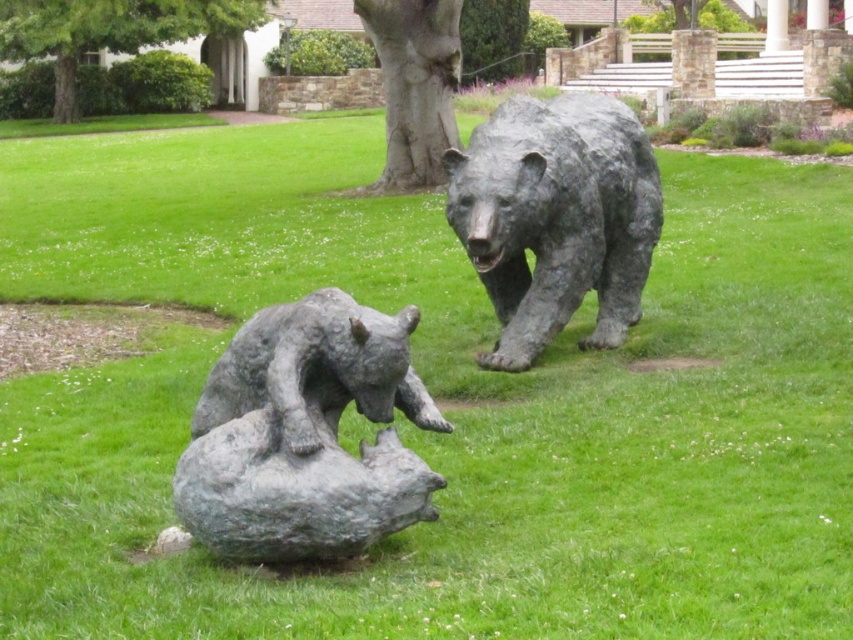
Between bronze bear at center and green leafy tree at upper center, which one has less height?

Standing shorter between the two is green leafy tree at upper center.

Is bronze bear at center wider than green leafy tree at upper center?

Yes.

Is point (250, 538) positioned behind point (229, 10)?

No.

Find the location of a particular element. bronze bear at center is located at coordinates (306, 435).

Does rough gray bear at center have a lesser height compared to green leafy tree at upper center?

In fact, rough gray bear at center may be taller than green leafy tree at upper center.

Between rough gray bear at center and green leafy tree at upper center, which one appears on the left side from the viewer's perspective?

green leafy tree at upper center is more to the left.

Describe the element at coordinates (556, 218) in the screenshot. The width and height of the screenshot is (853, 640). I see `rough gray bear at center` at that location.

Locate an element on the screen. rough gray bear at center is located at coordinates (556, 218).

Which is more to the left, rough gray bear at center or smooth gray tree trunk at center?

From the viewer's perspective, smooth gray tree trunk at center appears more on the left side.

Does rough gray bear at center come behind smooth gray tree trunk at center?

No, it is in front of smooth gray tree trunk at center.

The width and height of the screenshot is (853, 640). What are the coordinates of `rough gray bear at center` in the screenshot? It's located at (556, 218).